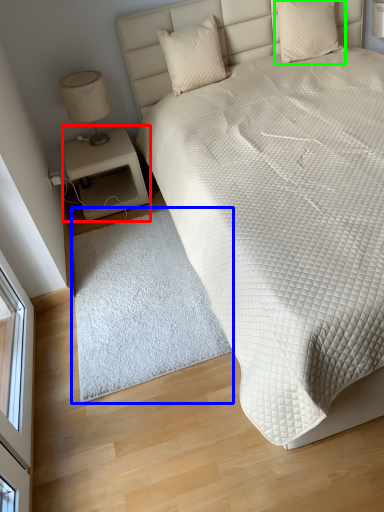
Question: Estimate the real-world distances between objects in this image. Which object is closer to nightstand (highlighted by a red box), mat (highlighted by a blue box) or pillow (highlighted by a green box)?

Choices:
 (A) mat
 (B) pillow

Answer: (A)